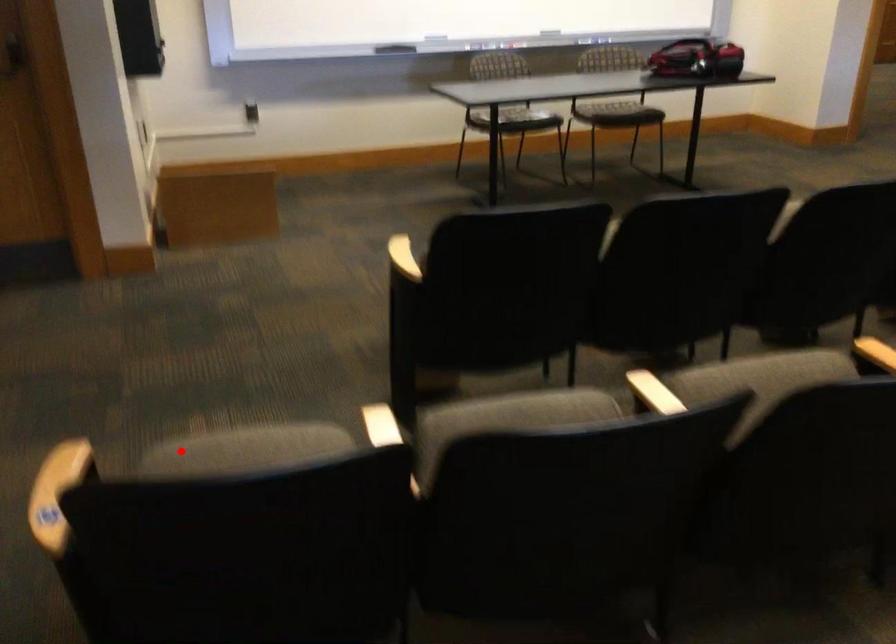
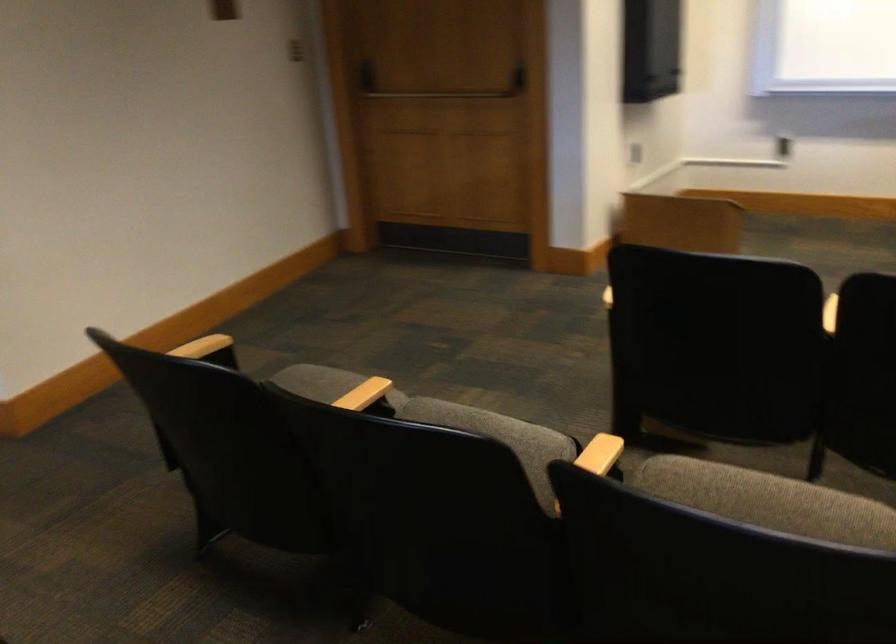
Question: I am providing you with two images of the same scene from different viewpoints. Image1 has a red point marked. In image2, the corresponding 3D location appears at what relative position? Reply with the corresponding letter.

Choices:
 (A) Closer
 (B) Farther

Answer: (B)